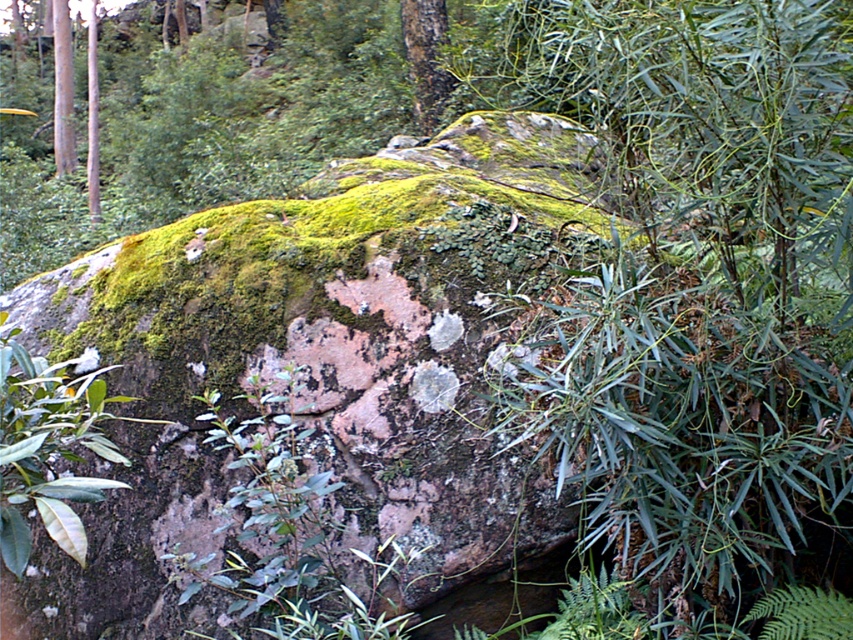
You are standing at the base of the smooth bark tree at upper center and want to place a 10 meter long rope between it and the large rock covered in vibrant green moss. Will the rope be long enough?

The distance between the smooth bark tree at upper center and the large rock covered in vibrant green moss is 8.53 meters. Since the rope is 10 meters long, it will be long enough to span the distance between them.

You are a bird looking for a place to perch. You see a smooth bark tree at upper center and a smooth brown tree trunk at left. Which one is closer to the ground?

The smooth brown tree trunk at left is closer to the ground because the smooth bark tree at upper center is positioned under it.

You are a hiker trying to decide which object to use as a support while climbing. You see the smooth brown tree trunk at left and the smooth brown pole at upper left. Which one is bigger and more stable to hold onto?

The smooth brown tree trunk at left has a larger size compared to the smooth brown pole at upper left, so it is bigger and more stable to hold onto.